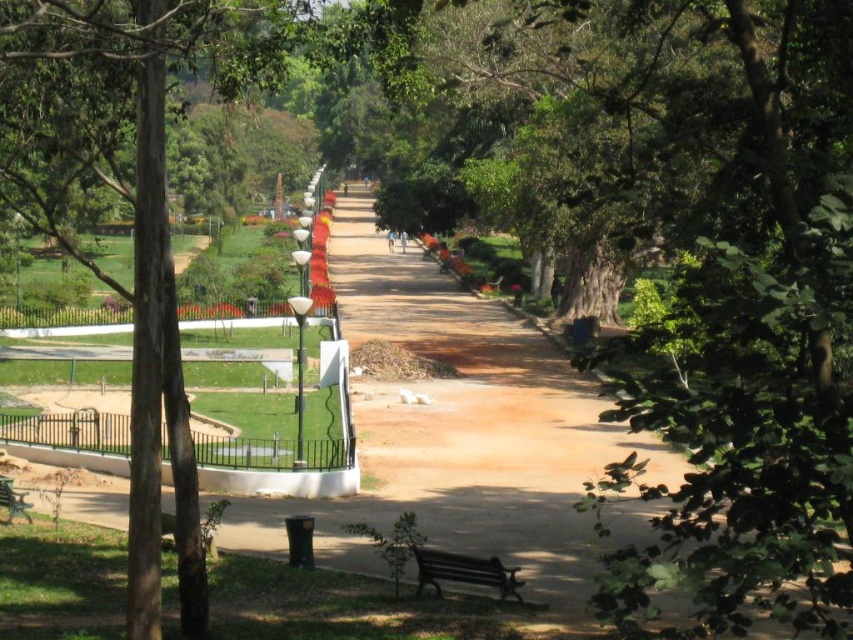
Consider the image. You are a park visitor sitting on the wooden bench at lower center and want to take a photo of the brown wood tree at left. Which direction should you turn your head to face the tree?

The brown wood tree at left is positioned on the left side of the wooden bench at lower center, so you should turn your head to your left to face the tree.

Looking at this image, you are a visitor in the park and want to sit on the wooden bench at lower center. However, there is a green painted wood bench at lower left blocking your view. Which bench should you approach first to get an unobstructed view of the pathway?

You should approach the green painted wood bench at lower left first because the wooden bench at lower center is located below it, meaning the lower bench would block your view until you move past the upper one.